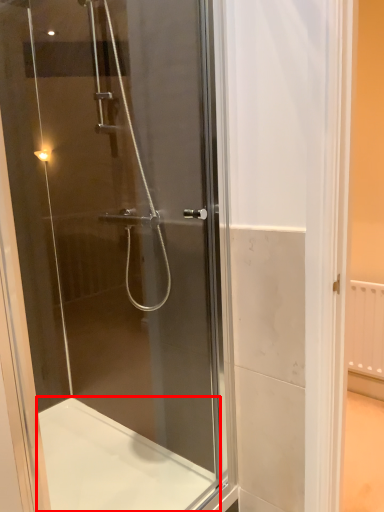
Question: From the image's perspective, considering the relative positions of bath (annotated by the red box) and screen door in the image provided, where is bath (annotated by the red box) located with respect to the staircase?

Choices:
 (A) above
 (B) below

Answer: (B)